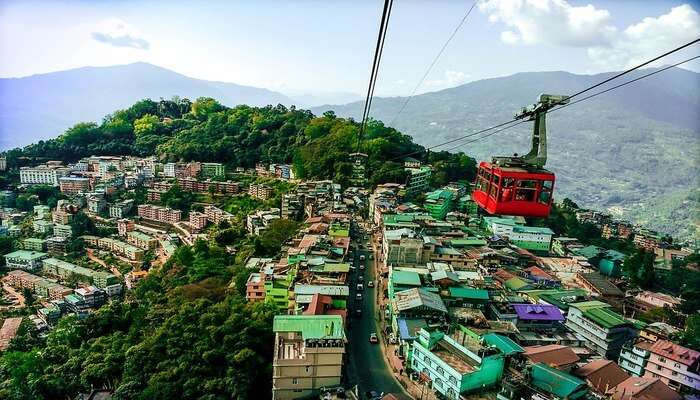
You are a GUI agent. You are given a task and a screenshot of the screen. Output one action in this format:
    pyautogui.click(x=<x>, y=<y>)
    Task: Click on the cable
    
    Given the screenshot: What is the action you would take?
    pyautogui.click(x=623, y=71), pyautogui.click(x=643, y=77), pyautogui.click(x=372, y=55), pyautogui.click(x=435, y=52), pyautogui.click(x=466, y=137), pyautogui.click(x=442, y=148), pyautogui.click(x=410, y=97)